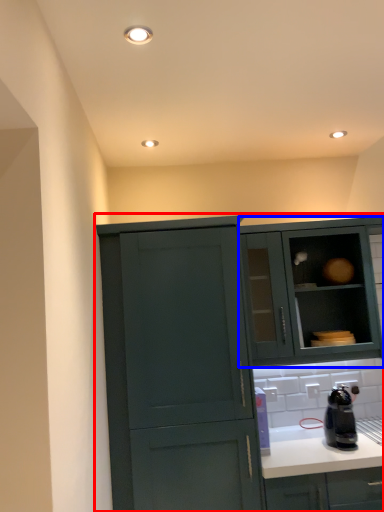
Question: Which of the following is the closest to the observer, cabinetry (highlighted by a red box) or cabinetry (highlighted by a blue box)?

Choices:
 (A) cabinetry
 (B) cabinetry

Answer: (A)